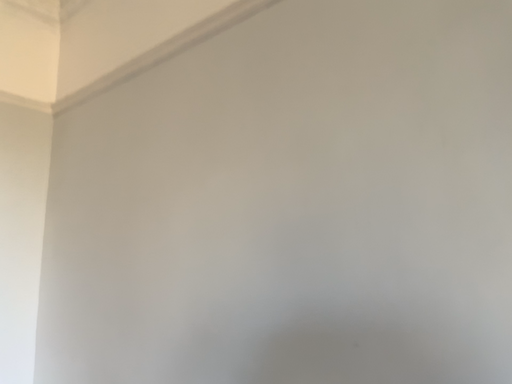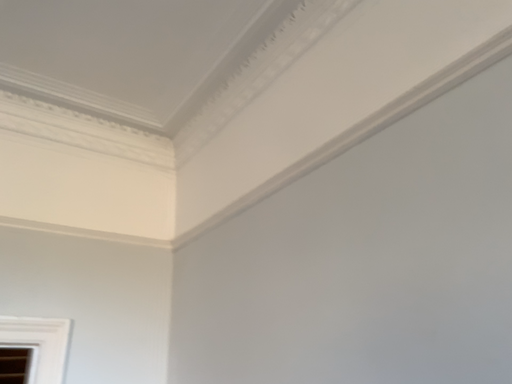
Question: How did the camera likely rotate when shooting the video?

Choices:
 (A) rotated upward
 (B) rotated downward

Answer: (A)